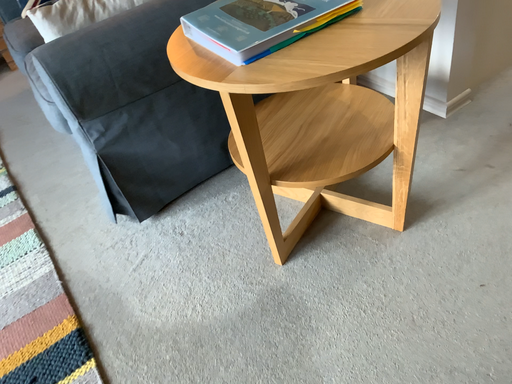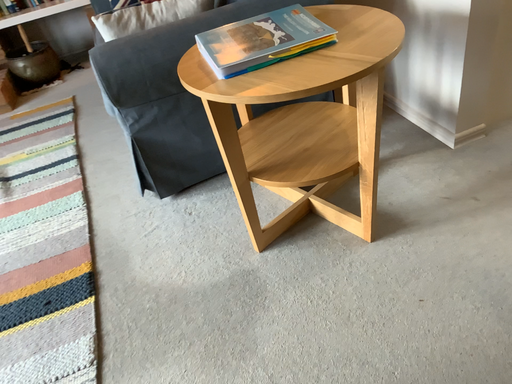
Question: Which way did the camera rotate in the video?

Choices:
 (A) rotated right
 (B) rotated left

Answer: (B)